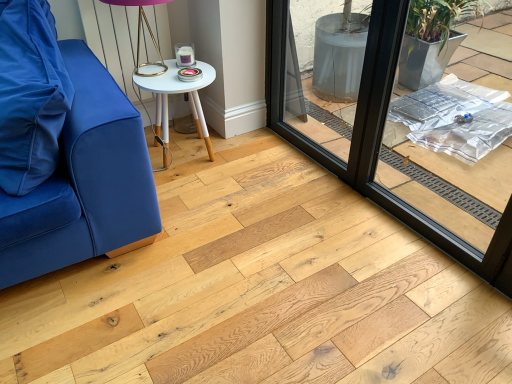
Image resolution: width=512 pixels, height=384 pixels. What do you see at coordinates (378, 136) in the screenshot? I see `black glass window frame at center` at bounding box center [378, 136].

I want to click on black glass window frame at center, so click(378, 136).

What is the approximate width of white wood side table at center?

The width of white wood side table at center is 16.33 inches.

Where is `black glass window frame at center`? black glass window frame at center is located at coordinates (378, 136).

Would you say white wood side table at center is part of black glass window frame at center's contents?

No, white wood side table at center is not inside black glass window frame at center.

Which is in front, point (357, 130) or point (211, 74)?

The point (357, 130) is more forward.

Is black glass window frame at center further to camera compared to white wood side table at center?

No, black glass window frame at center is closer to the viewer.

Is the position of metallic gold table lamp at upper center less distant than that of black glass window frame at center?

No, it is not.

Can you tell me how much metallic gold table lamp at upper center and black glass window frame at center differ in facing direction?

82.5 degrees separate the facing orientations of metallic gold table lamp at upper center and black glass window frame at center.

From a real-world perspective, is metallic gold table lamp at upper center physically above black glass window frame at center?

Yes, from a real-world perspective, metallic gold table lamp at upper center is above black glass window frame at center.

Based on the photo, is metallic gold table lamp at upper center turned away from black glass window frame at center?

No, metallic gold table lamp at upper center is not facing away from black glass window frame at center.

What's the angular difference between matte blue cushion at left and white wood side table at center's facing directions?

There is a 93.4-degree angle between the facing directions of matte blue cushion at left and white wood side table at center.

Can you see matte blue cushion at left touching white wood side table at center?

No, matte blue cushion at left is not making contact with white wood side table at center.

Is matte blue cushion at left not within white wood side table at center?

That's correct, matte blue cushion at left is outside of white wood side table at center.

From the image's perspective, does matte blue cushion at left appear lower than white wood side table at center?

Indeed, from the image's perspective, matte blue cushion at left is shown beneath white wood side table at center.

From their relative heights in the image, would you say black glass window frame at center is taller or shorter than matte blue cushion at left?

black glass window frame at center is taller than matte blue cushion at left.

Is black glass window frame at center turned away from matte blue cushion at left?

No, black glass window frame at center's orientation is not away from matte blue cushion at left.

From a real-world perspective, is black glass window frame at center on top of matte blue cushion at left?

No, from a real-world perspective, black glass window frame at center is not on top of matte blue cushion at left.

From the image's perspective, is black glass window frame at center above or below matte blue cushion at left?

Based on their image positions, black glass window frame at center is located above matte blue cushion at left.

From the image's perspective, is white wood side table at center positioned above or below metallic gold table lamp at upper center?

white wood side table at center is situated lower than metallic gold table lamp at upper center in the image.

Is white wood side table at center oriented towards metallic gold table lamp at upper center?

No, white wood side table at center does not turn towards metallic gold table lamp at upper center.

Is white wood side table at center next to metallic gold table lamp at upper center and touching it?

No, white wood side table at center is not touching metallic gold table lamp at upper center.

Does white wood side table at center have a smaller size compared to metallic gold table lamp at upper center?

No, white wood side table at center is not smaller than metallic gold table lamp at upper center.

Considering the sizes of objects metallic gold table lamp at upper center and matte blue cushion at left in the image provided, who is bigger, metallic gold table lamp at upper center or matte blue cushion at left?

Bigger between the two is matte blue cushion at left.

Which is behind, point (119, 4) or point (38, 168)?

The point (119, 4) is behind.

The width and height of the screenshot is (512, 384). I want to click on table lamp below the matte blue cushion at left (from a real-world perspective), so click(140, 33).

Are metallic gold table lamp at upper center and matte blue cushion at left making contact?

No, metallic gold table lamp at upper center is not in contact with matte blue cushion at left.

Is matte blue cushion at left positioned behind black glass window frame at center?

Yes, it is behind black glass window frame at center.

Is matte blue cushion at left aimed at black glass window frame at center?

No, matte blue cushion at left is not aimed at black glass window frame at center.

How different are the orientations of matte blue cushion at left and black glass window frame at center in degrees?

9.08 degrees.

From the image's perspective, which is above, matte blue cushion at left or black glass window frame at center?

black glass window frame at center appears higher in the image.

This screenshot has width=512, height=384. I want to click on table behind the black glass window frame at center, so click(178, 93).

Find the location of a particular element. The height and width of the screenshot is (384, 512). window frame below the metallic gold table lamp at upper center (from a real-world perspective) is located at coordinates (378, 136).

Considering their positions, is matte blue cushion at left positioned closer to black glass window frame at center than metallic gold table lamp at upper center?

Based on the image, metallic gold table lamp at upper center appears to be nearer to black glass window frame at center.

Considering their positions, is metallic gold table lamp at upper center positioned closer to white wood side table at center than black glass window frame at center?

metallic gold table lamp at upper center is positioned closer to the anchor white wood side table at center.

Which object lies nearer to the anchor point white wood side table at center, black glass window frame at center or metallic gold table lamp at upper center?

metallic gold table lamp at upper center is positioned closer to the anchor white wood side table at center.

From the picture: Which object lies further to the anchor point white wood side table at center, black glass window frame at center or matte blue cushion at left?

Among the two, matte blue cushion at left is located further to white wood side table at center.

Based on their spatial positions, is matte blue cushion at left or black glass window frame at center further from metallic gold table lamp at upper center?

black glass window frame at center.

From the image, which object appears to be farther from metallic gold table lamp at upper center, white wood side table at center or matte blue cushion at left?

matte blue cushion at left is further to metallic gold table lamp at upper center.

Considering their positions, is metallic gold table lamp at upper center positioned closer to black glass window frame at center than matte blue cushion at left?

metallic gold table lamp at upper center is closer to black glass window frame at center.

Estimate the real-world distances between objects in this image. Which object is closer to black glass window frame at center, white wood side table at center or metallic gold table lamp at upper center?

Based on the image, white wood side table at center appears to be nearer to black glass window frame at center.

Find the location of `table lamp between matte blue cushion at left and white wood side table at center along the z-axis`. table lamp between matte blue cushion at left and white wood side table at center along the z-axis is located at coordinates (140, 33).

This screenshot has width=512, height=384. Find the location of `table lamp situated between matte blue cushion at left and black glass window frame at center from left to right`. table lamp situated between matte blue cushion at left and black glass window frame at center from left to right is located at coordinates (140, 33).

This screenshot has height=384, width=512. Identify the location of table between metallic gold table lamp at upper center and black glass window frame at center in the horizontal direction. (178, 93).

What are the coordinates of `table situated between matte blue cushion at left and black glass window frame at center from left to right` in the screenshot? It's located at (178, 93).